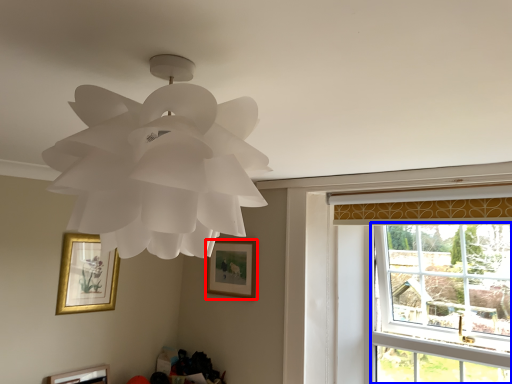
Question: Which point is further to the camera, picture frame (highlighted by a red box) or window (highlighted by a blue box)?

Choices:
 (A) picture frame
 (B) window

Answer: (A)